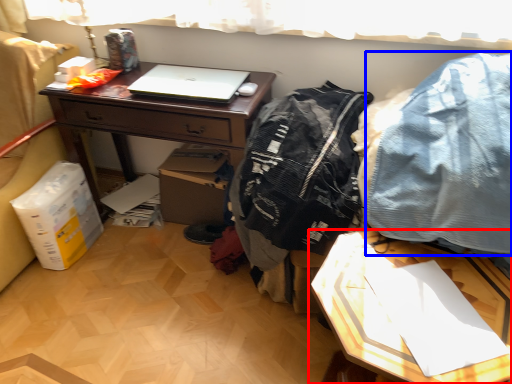
Question: Among these objects, which one is farthest to the camera, table (highlighted by a red box) or clothing (highlighted by a blue box)?

Choices:
 (A) table
 (B) clothing

Answer: (B)